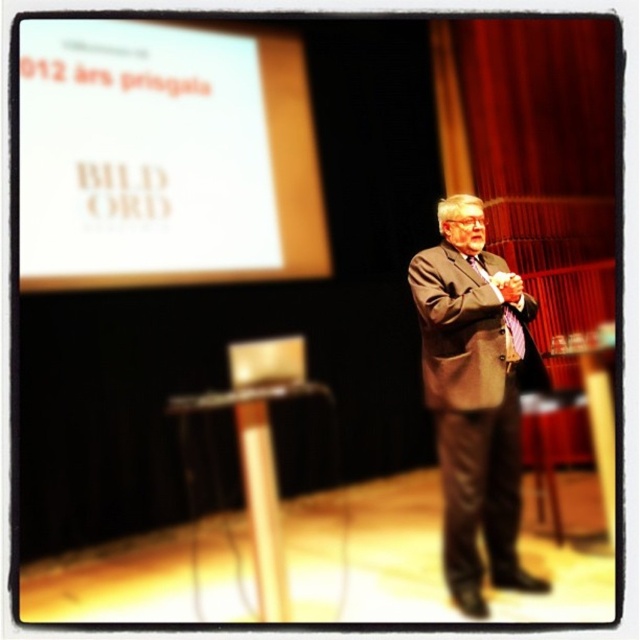
Question: Considering the relative positions of white paper at upper left and brown suit at center in the image provided, where is white paper at upper left located with respect to brown suit at center?

Choices:
 (A) above
 (B) below

Answer: (A)

Question: Among these points, which one is farthest from the camera?

Choices:
 (A) (65, 209)
 (B) (492, 481)

Answer: (B)

Question: Is white paper at upper left closer to camera compared to brown suit at center?

Choices:
 (A) yes
 (B) no

Answer: (B)

Question: Does white paper at upper left have a smaller size compared to brown suit at center?

Choices:
 (A) yes
 (B) no

Answer: (B)

Question: Which point is farther from the camera taking this photo?

Choices:
 (A) (180, 196)
 (B) (424, 310)

Answer: (A)